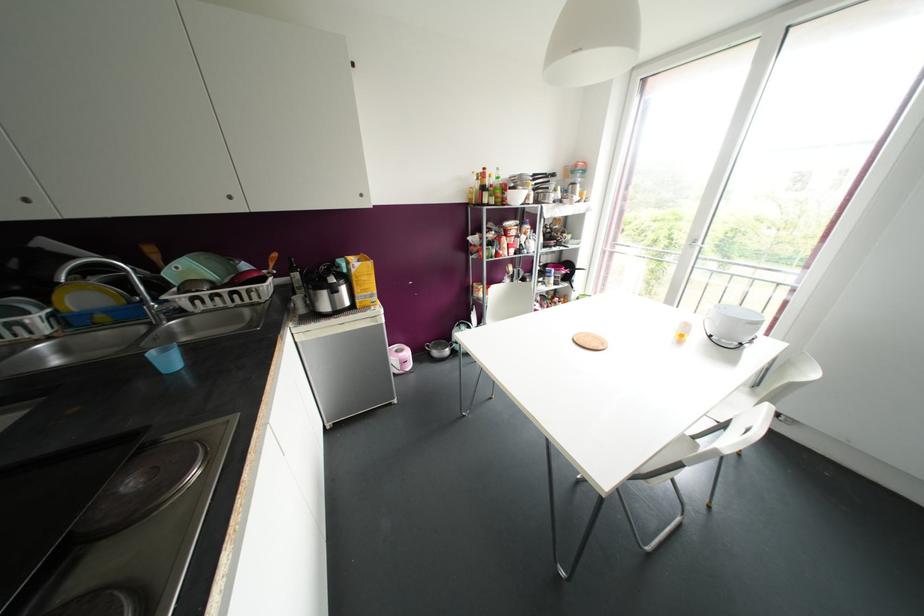
Locate an element on the screen. Image resolution: width=924 pixels, height=616 pixels. small blue cup is located at coordinates [165, 358].